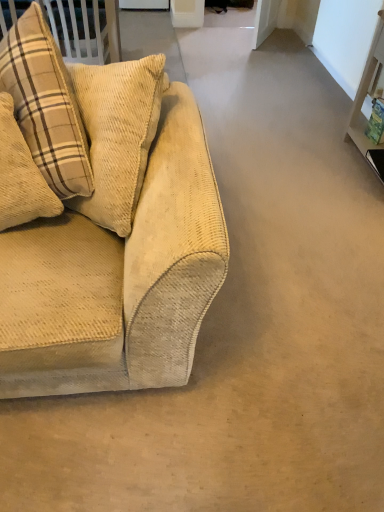
Identify the location of vacant region to the right of beige corduroy couch at left. Image resolution: width=384 pixels, height=512 pixels. (268, 297).